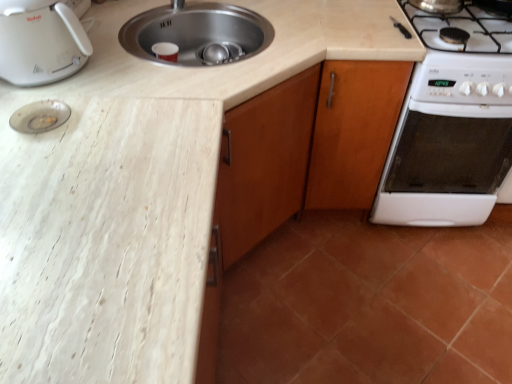
Find the location of `free space in front of transparent glass plate at upper left`. free space in front of transparent glass plate at upper left is located at coordinates (36, 158).